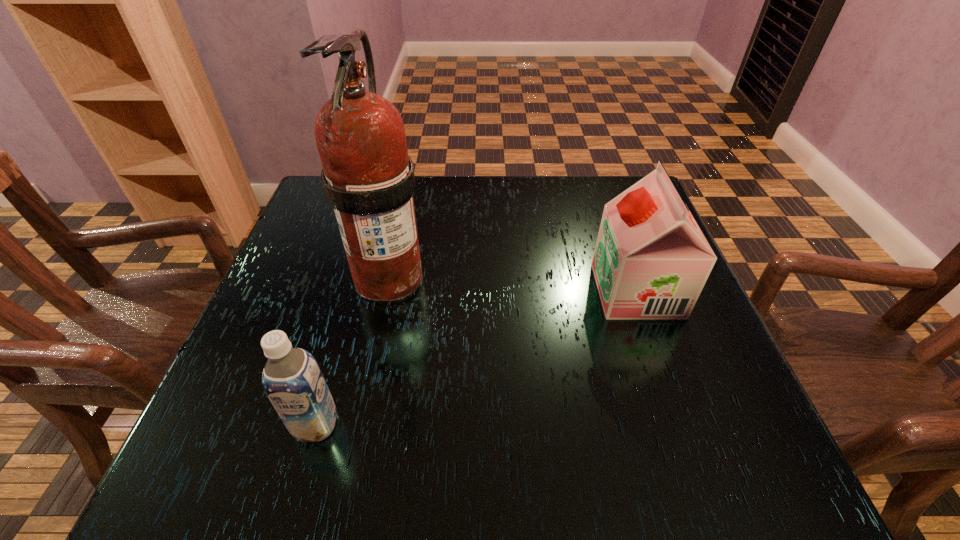
Where is `fire extinguisher`? The image size is (960, 540). fire extinguisher is located at coordinates (368, 177).

Where is `the right soya milk`? The width and height of the screenshot is (960, 540). the right soya milk is located at coordinates (651, 261).

Locate an element on the screen. The width and height of the screenshot is (960, 540). the rightmost object is located at coordinates (651, 261).

Locate an element on the screen. the nearer soya milk is located at coordinates coord(292,379).

Identify the location of the shorter soya milk. The height and width of the screenshot is (540, 960). (292, 379).

The height and width of the screenshot is (540, 960). Identify the location of free space located at the nozzle of the fire extinguisher. (345, 481).

In order to click on vacant region located with the cap open on the rightmost object in this screenshot , I will do `click(424, 291)`.

Identify the location of vacant region located 0.230m with the cap open on the rightmost object. (491, 291).

Locate an element on the screen. The height and width of the screenshot is (540, 960). vacant space located with the cap open on the rightmost object is located at coordinates (533, 291).

You are a GUI agent. You are given a task and a screenshot of the screen. Output one action in this format:
    pyautogui.click(x=<x>, y=<y>)
    Task: Click on the object positioned at the near edge
    This screenshot has width=960, height=540.
    Given the screenshot: What is the action you would take?
    pyautogui.click(x=292, y=379)